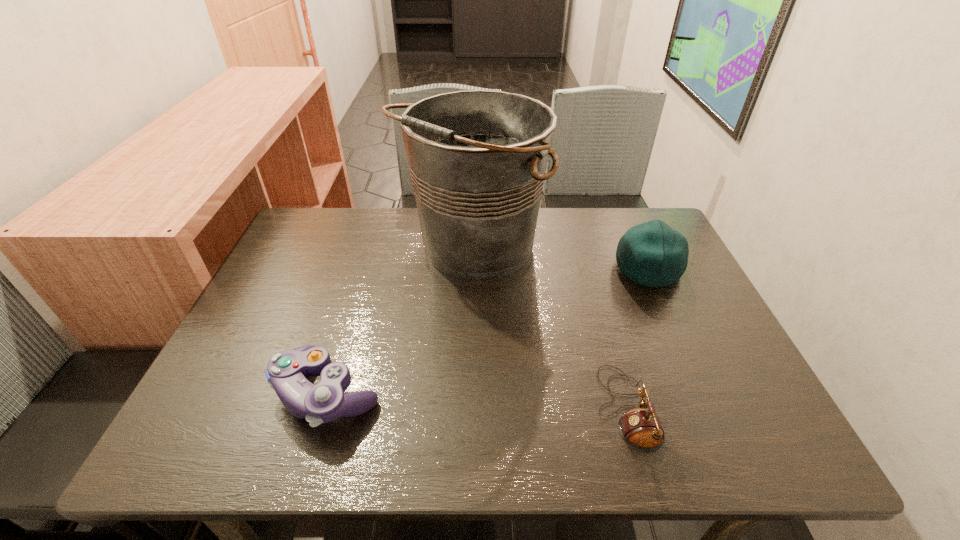
Where is `vacant space located on the rotary dial of the third object from left to right`? This screenshot has width=960, height=540. vacant space located on the rotary dial of the third object from left to right is located at coordinates (512, 408).

Identify the location of vacant area located on the rotary dial of the third object from left to right. (501, 408).

Locate an element on the screen. The height and width of the screenshot is (540, 960). bucket present at the far edge is located at coordinates (478, 158).

In order to click on beanie positioned at the far edge in this screenshot , I will do `click(653, 254)`.

At what (x,y) coordinates should I click in order to perform the action: click on control present at the near edge. Please return your answer as a coordinate pair (x, y). Looking at the image, I should click on (286, 373).

Locate an element on the screen. The width and height of the screenshot is (960, 540). telephone located at the near edge is located at coordinates (641, 429).

You are a GUI agent. You are given a task and a screenshot of the screen. Output one action in this format:
    pyautogui.click(x=<x>, y=<y>)
    Task: Click on the object that is positioned at the left edge
    
    Given the screenshot: What is the action you would take?
    pyautogui.click(x=286, y=373)

Image resolution: width=960 pixels, height=540 pixels. In order to click on object that is positioned at the right edge in this screenshot , I will do `click(653, 254)`.

I want to click on object situated at the near left corner, so click(286, 373).

Locate an element on the screen. object that is at the far right corner is located at coordinates (653, 254).